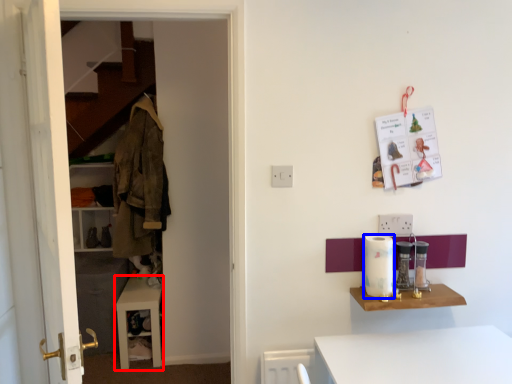
Question: Which of the following is the farthest to the observer, table (highlighted by a red box) or appliance (highlighted by a blue box)?

Choices:
 (A) table
 (B) appliance

Answer: (A)